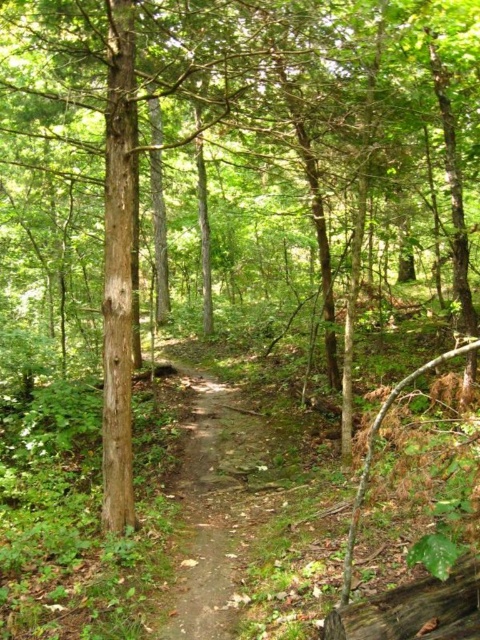
Is point (204, 396) farther from camera compared to point (477, 566)?

Yes, it is.

Does dirt path at center appear on the left side of brown rough log at lower right?

Correct, you'll find dirt path at center to the left of brown rough log at lower right.

Between point (214, 528) and point (427, 637), which one is positioned behind?

The point (214, 528) is behind.

Locate an element on the screen. This screenshot has height=640, width=480. dirt path at center is located at coordinates (211, 509).